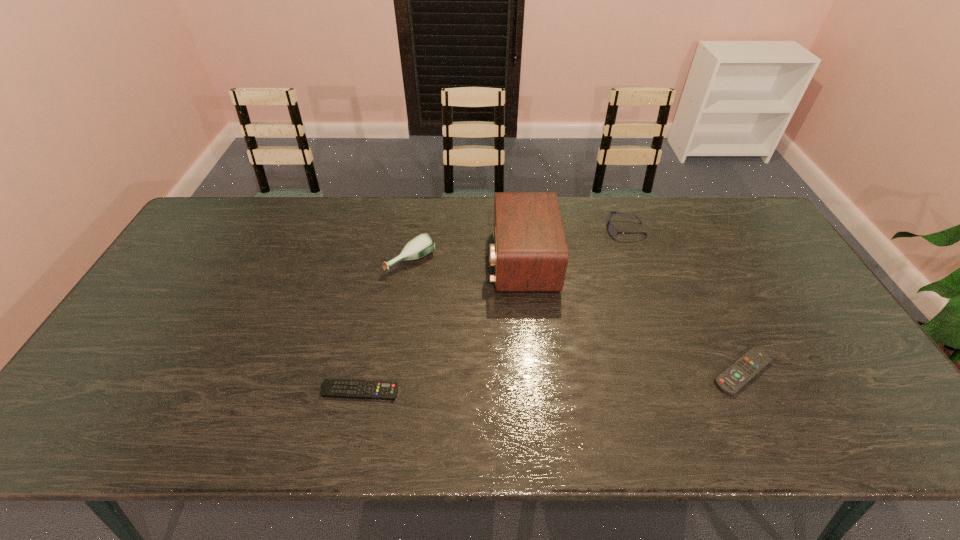
You are a GUI agent. You are given a task and a screenshot of the screen. Output one action in this format:
    pyautogui.click(x=<x>, y=<y>)
    Task: Click on the vacant region at the left edge
    The width and height of the screenshot is (960, 540).
    Given the screenshot: What is the action you would take?
    pyautogui.click(x=94, y=404)

At what (x,y) coordinates should I click in order to perform the action: click on free point at the right edge. Please return your answer as a coordinate pair (x, y). This screenshot has height=540, width=960. Looking at the image, I should click on (756, 245).

This screenshot has height=540, width=960. Find the location of `vacant space at the far left corner of the desktop`. vacant space at the far left corner of the desktop is located at coordinates (238, 222).

This screenshot has width=960, height=540. Identify the location of blank area at the far right corner. (743, 203).

What are the coordinates of `free spot between the left remote control and the fourth object from left to right` in the screenshot? It's located at (492, 310).

In order to click on free space that is in between the left remote control and the third object from right to left in this screenshot , I will do point(441,326).

Where is `free space between the left remote control and the second tallest object`? The image size is (960, 540). free space between the left remote control and the second tallest object is located at coordinates (385, 326).

Locate an element on the screen. The image size is (960, 540). vacant area between the tallest object and the left remote control is located at coordinates (441, 326).

You are a GUI agent. You are given a task and a screenshot of the screen. Output one action in this format:
    pyautogui.click(x=<x>, y=<y>)
    Task: Click on the unoccupied position between the rightmost object and the radio receiver
    The height and width of the screenshot is (540, 960).
    Given the screenshot: What is the action you would take?
    [x=633, y=316]

Where is `vacant area that lies between the third object from left to right and the second object from right to left`? The height and width of the screenshot is (540, 960). vacant area that lies between the third object from left to right and the second object from right to left is located at coordinates (574, 245).